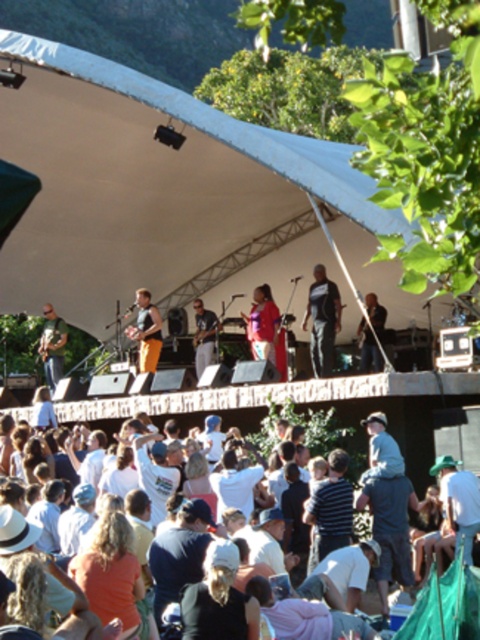
Question: Which object is positioned closest to the light brown leather jacket at center?

Choices:
 (A) orange cotton pants at center
 (B) red fabric shirt at center

Answer: (A)

Question: Can you confirm if white cotton crowd at lower center is positioned to the right of orange cotton pants at center?

Choices:
 (A) no
 (B) yes

Answer: (B)

Question: Is red fabric shirt at center bigger than orange cotton pants at center?

Choices:
 (A) no
 (B) yes

Answer: (B)

Question: Which of the following is the closest to the observer?

Choices:
 (A) (276, 326)
 (B) (450, 577)

Answer: (B)

Question: Which point is farther from the camera taking this photo?

Choices:
 (A) (210, 340)
 (B) (264, 346)
 (C) (141, 317)

Answer: (A)

Question: Is orange cotton pants at center wider than light brown leather jacket at center?

Choices:
 (A) yes
 (B) no

Answer: (A)